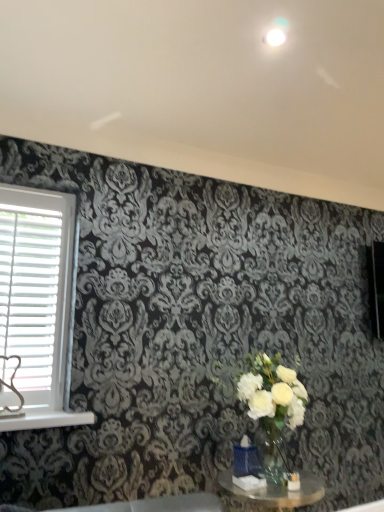
You are a GUI agent. You are given a task and a screenshot of the screen. Output one action in this format:
    pyautogui.click(x=<x>, y=<y>)
    Task: Click on the vacant point above white plastic window sill at lower left (from a real-world perspective)
    This screenshot has width=384, height=512.
    Given the screenshot: What is the action you would take?
    pyautogui.click(x=43, y=416)